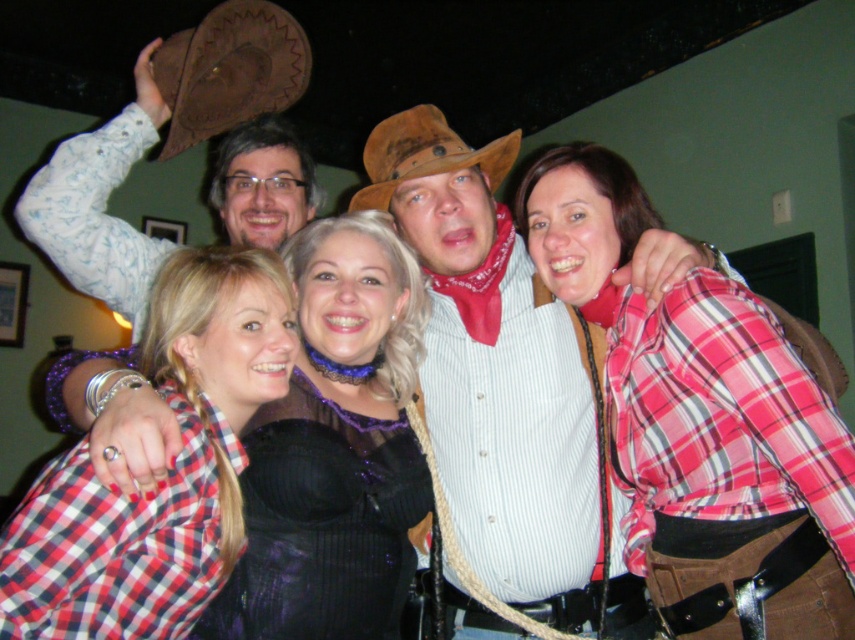
You are trying to decide which item to grab first from the group photo. The plaid cotton shirt at center and the brown leather cowboy hat at upper left are both in your line of sight. Based on their positions, which item is located to the right of the other?

The plaid cotton shirt at center is positioned on the right side of brown leather cowboy hat at upper left, so the plaid cotton shirt at center is to the right of the brown leather cowboy hat at upper left.